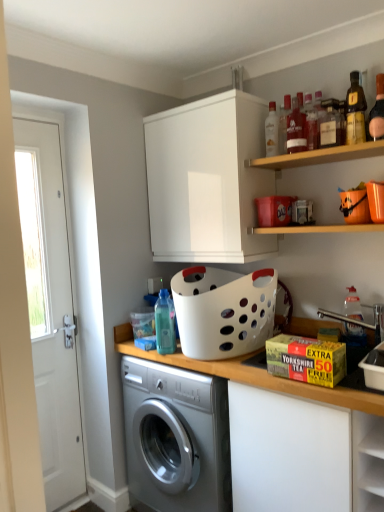
Image resolution: width=384 pixels, height=512 pixels. Find the location of `vacant space in front of clear glass bottle at upper center, which is counted as the second bottle, starting from the left`. vacant space in front of clear glass bottle at upper center, which is counted as the second bottle, starting from the left is located at coordinates (288, 155).